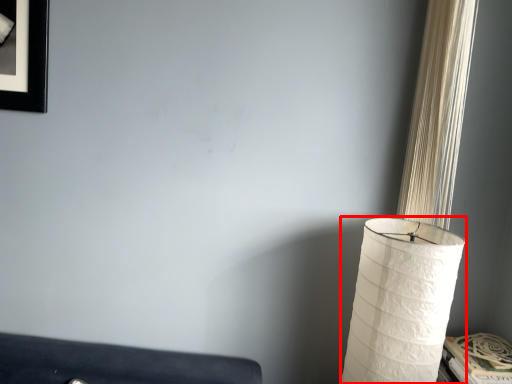
Question: From the image's perspective, where is lamp (annotated by the red box) located in relation to curtain in the image?

Choices:
 (A) below
 (B) above

Answer: (A)